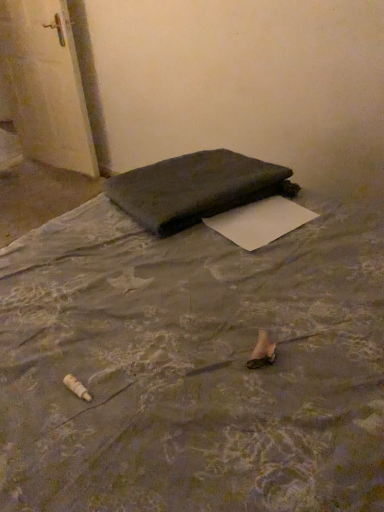
Question: Considering the positions of point (11, 38) and point (230, 205), is point (11, 38) closer or farther from the camera than point (230, 205)?

Choices:
 (A) closer
 (B) farther

Answer: (B)

Question: From the image's perspective, is white glossy door at upper left positioned above or below dark fabric bag at center?

Choices:
 (A) below
 (B) above

Answer: (B)

Question: Which object is positioned closest to the dark fabric mattress at center?

Choices:
 (A) dark fabric bag at center
 (B) white paper at center
 (C) white glossy door at upper left

Answer: (B)

Question: Which of these objects is positioned closest to the white glossy door at upper left?

Choices:
 (A) dark fabric mattress at center
 (B) white paper at center
 (C) dark fabric bag at center

Answer: (C)